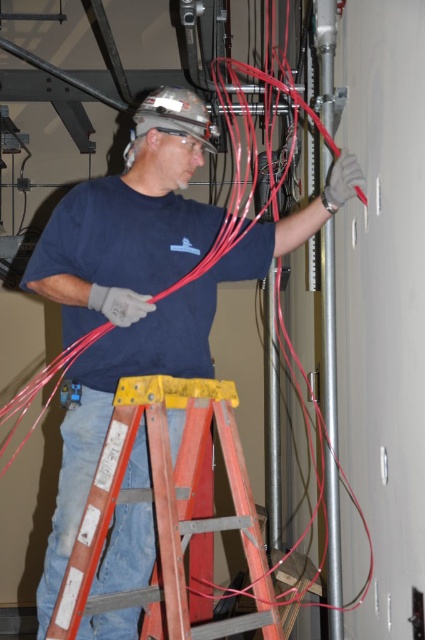
You are an inspector checking the safety of the construction site. You notice the matte black shirt at center and the red wood ladder at center. Which object is wider from your perspective?

The matte black shirt at center is wider than the red wood ladder at center.

You are an inspector checking the safety of the construction site. You notice the matte black shirt at center and the red wood ladder at center. Which object is closer to the inspector?

The matte black shirt at center is closer to the inspector because the red wood ladder at center is behind it.

You are a safety inspector checking the workspace. You notice the matte black shirt at center and the red wood ladder at center. According to safety regulations, workers must maintain a minimum distance of 15 inches from the ladder to prevent tripping hazards. Is the current distance compliant with this requirement?

The matte black shirt at center is 13.39 inches from the red wood ladder at center. Since 13.39 inches is less than the required 15 inches, the current distance does not comply with the safety regulation to prevent tripping hazards.